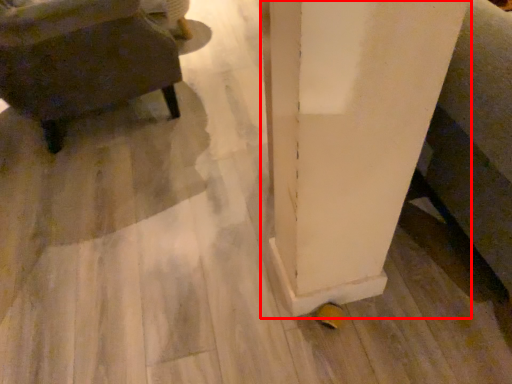
Question: Considering the relative positions of pillar (annotated by the red box) and furniture in the image provided, where is pillar (annotated by the red box) located with respect to the staircase?

Choices:
 (A) left
 (B) right

Answer: (B)